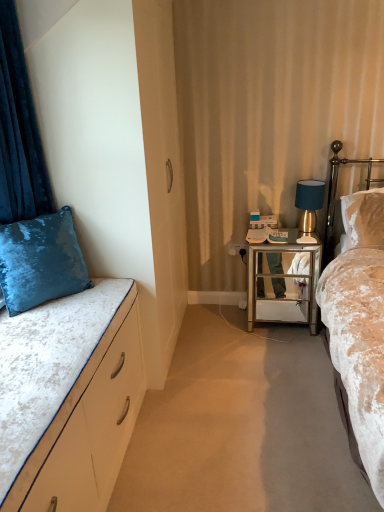
Question: From a real-world perspective, is velvet beige bed at right, which appears as the 1th bed when viewed from the right, positioned under velvet white bed at left, the second bed viewed from the right, based on gravity?

Choices:
 (A) no
 (B) yes

Answer: (B)

Question: Does velvet beige bed at right, the 2th bed when ordered from left to right, lie in front of velvet white bed at left, the first bed viewed from the left?

Choices:
 (A) no
 (B) yes

Answer: (B)

Question: Can you confirm if velvet beige bed at right, which appears as the 1th bed when viewed from the right, is smaller than velvet white bed at left, the first bed viewed from the left?

Choices:
 (A) no
 (B) yes

Answer: (A)

Question: Is the surface of velvet beige bed at right, which appears as the 1th bed when viewed from the right, in direct contact with velvet white bed at left, the second bed viewed from the right?

Choices:
 (A) yes
 (B) no

Answer: (B)

Question: Does velvet beige bed at right, which appears as the 1th bed when viewed from the right, have a greater height compared to velvet white bed at left, the first bed viewed from the left?

Choices:
 (A) no
 (B) yes

Answer: (B)

Question: From a real-world perspective, is velvet beige bed at right, the 2th bed when ordered from left to right, on velvet white bed at left, the second bed viewed from the right?

Choices:
 (A) yes
 (B) no

Answer: (B)

Question: Is blue velvet lamp at upper right a part of white glossy power outlet at center?

Choices:
 (A) yes
 (B) no

Answer: (B)

Question: Can you confirm if white glossy power outlet at center is positioned to the left of blue velvet lamp at upper right?

Choices:
 (A) no
 (B) yes

Answer: (B)

Question: Is blue velvet lamp at upper right at the back of white glossy power outlet at center?

Choices:
 (A) no
 (B) yes

Answer: (A)

Question: Considering the relative positions of white glossy power outlet at center and blue velvet lamp at upper right in the image provided, is white glossy power outlet at center to the right of blue velvet lamp at upper right from the viewer's perspective?

Choices:
 (A) no
 (B) yes

Answer: (A)

Question: Does white glossy power outlet at center have a smaller size compared to blue velvet lamp at upper right?

Choices:
 (A) yes
 (B) no

Answer: (A)

Question: Is white glossy power outlet at center oriented towards blue velvet lamp at upper right?

Choices:
 (A) yes
 (B) no

Answer: (B)

Question: Is white glossy power outlet at center next to velvet beige bed at right, the 2th bed when ordered from left to right?

Choices:
 (A) yes
 (B) no

Answer: (B)